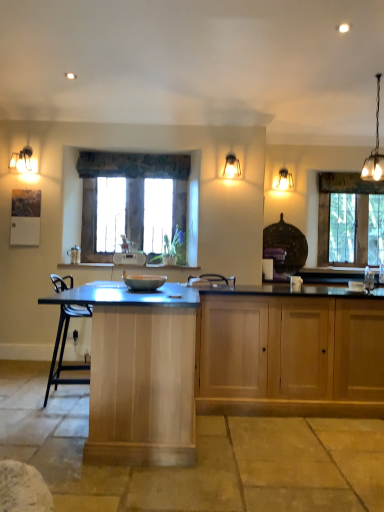
Question: Would you say matte gray bowl at center is a long distance from wooden cabinet at lower right, which is the first cabinetry from right to left?

Choices:
 (A) no
 (B) yes

Answer: (B)

Question: Does matte gray bowl at center have a greater width compared to wooden cabinet at lower right, which is the second cabinetry in left-to-right order?

Choices:
 (A) yes
 (B) no

Answer: (B)

Question: Is matte gray bowl at center to the left of wooden cabinet at lower right, which is the second cabinetry in left-to-right order, from the viewer's perspective?

Choices:
 (A) yes
 (B) no

Answer: (A)

Question: Would you say matte gray bowl at center contains wooden cabinet at lower right, which is the first cabinetry from right to left?

Choices:
 (A) no
 (B) yes

Answer: (A)

Question: Is matte gray bowl at center in front of wooden cabinet at lower right, which is the second cabinetry in left-to-right order?

Choices:
 (A) no
 (B) yes

Answer: (B)

Question: From the image's perspective, relative to matte glass lampshade at upper center, acting as the 2th lamp starting from the left, is matte gray bowl at center above or below?

Choices:
 (A) above
 (B) below

Answer: (B)

Question: Considering their positions, is matte gray bowl at center located in front of or behind matte glass lampshade at upper center, which is counted as the 2th lamp, starting from the front?

Choices:
 (A) behind
 (B) front

Answer: (B)

Question: From a real-world perspective, is matte gray bowl at center above or below matte glass lampshade at upper center, acting as the 2th lamp starting from the left?

Choices:
 (A) below
 (B) above

Answer: (A)

Question: Considering the positions of matte gray bowl at center and matte glass lampshade at upper center, which is counted as the 2th lamp, starting from the front, in the image, is matte gray bowl at center wider or thinner than matte glass lampshade at upper center, which is counted as the 2th lamp, starting from the front,?

Choices:
 (A) thin
 (B) wide

Answer: (B)

Question: Considering their positions, is matte white pendant light at upper left, acting as the first lamp starting from the left, located in front of or behind matte glass lampshade at upper center, the 2th lamp from the right?

Choices:
 (A) behind
 (B) front

Answer: (B)

Question: Would you say matte white pendant light at upper left, the 1th lamp from the front, is to the left or to the right of matte glass lampshade at upper center, acting as the 2th lamp starting from the left, in the picture?

Choices:
 (A) left
 (B) right

Answer: (A)

Question: Looking at their shapes, would you say matte white pendant light at upper left, the 1th lamp from the front, is wider or thinner than matte glass lampshade at upper center, acting as the 2th lamp starting from the left?

Choices:
 (A) thin
 (B) wide

Answer: (B)

Question: From the image's perspective, relative to matte glass lampshade at upper center, the 2th lamp from the right, is matte white pendant light at upper left, the 1th lamp from the front, above or below?

Choices:
 (A) below
 (B) above

Answer: (B)

Question: Considering the positions of matte gray bowl at center and wooden cabinet at lower right, which is the first cabinetry from right to left, in the image, is matte gray bowl at center taller or shorter than wooden cabinet at lower right, which is the first cabinetry from right to left,?

Choices:
 (A) short
 (B) tall

Answer: (A)

Question: In terms of width, does matte gray bowl at center look wider or thinner when compared to wooden cabinet at lower right, which is the first cabinetry from right to left?

Choices:
 (A) wide
 (B) thin

Answer: (B)